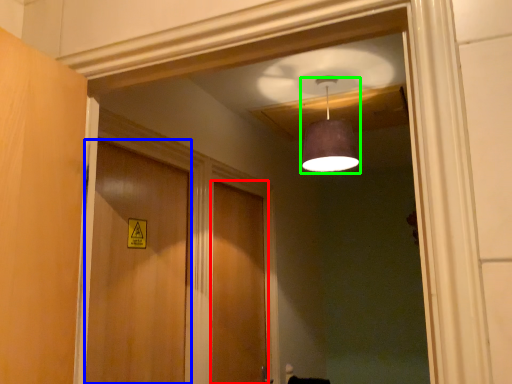
Question: Estimate the real-world distances between objects in this image. Which object is closer to door (highlighted by a red box), door (highlighted by a blue box) or light fixture (highlighted by a green box)?

Choices:
 (A) door
 (B) light fixture

Answer: (A)